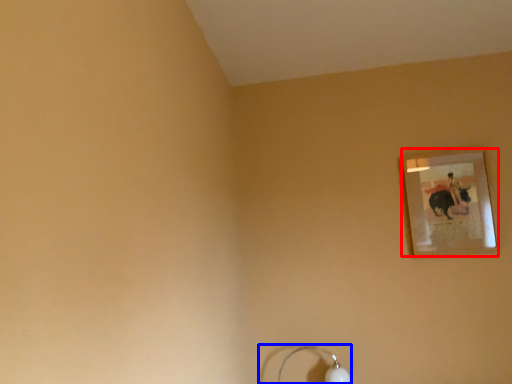
Question: Which object is closer to the camera taking this photo, picture frame (highlighted by a red box) or lamp (highlighted by a blue box)?

Choices:
 (A) picture frame
 (B) lamp

Answer: (B)